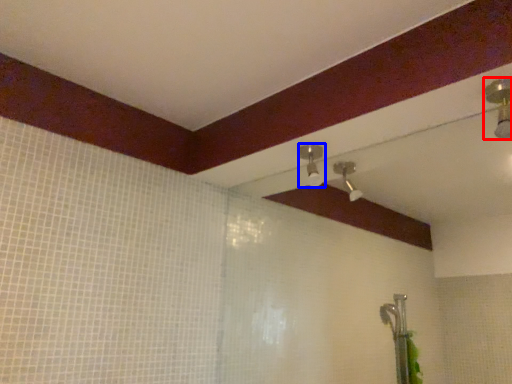
Question: Among these objects, which one is farthest to the camera, shower (highlighted by a red box) or shower (highlighted by a blue box)?

Choices:
 (A) shower
 (B) shower

Answer: (B)